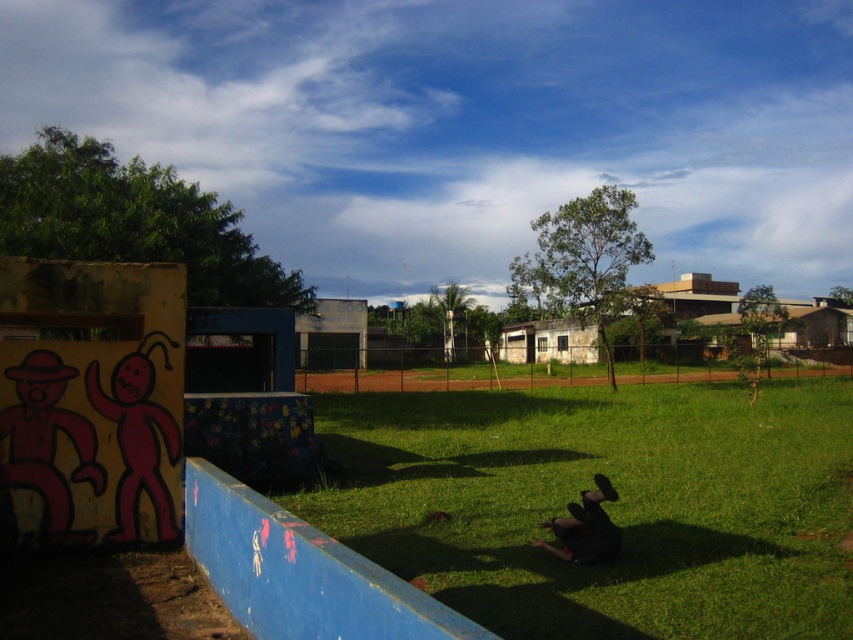
Question: Is matte red figure at lower left closer to the viewer compared to dark gray fabric person at lower center?

Choices:
 (A) yes
 (B) no

Answer: (B)

Question: Which object is the farthest from the green grass at center?

Choices:
 (A) dark gray fabric person at lower center
 (B) matte red figure at lower left

Answer: (A)

Question: Based on their relative distances, which object is nearer to the matte red figure at lower left?

Choices:
 (A) green grass at center
 (B) dark gray fabric person at lower center

Answer: (B)

Question: Is the position of green grass at center less distant than that of dark gray fabric person at lower center?

Choices:
 (A) yes
 (B) no

Answer: (A)

Question: Is green grass at center below dark gray fabric person at lower center?

Choices:
 (A) yes
 (B) no

Answer: (A)

Question: Among these objects, which one is farthest from the camera?

Choices:
 (A) matte red figure at lower left
 (B) green grass at center

Answer: (A)